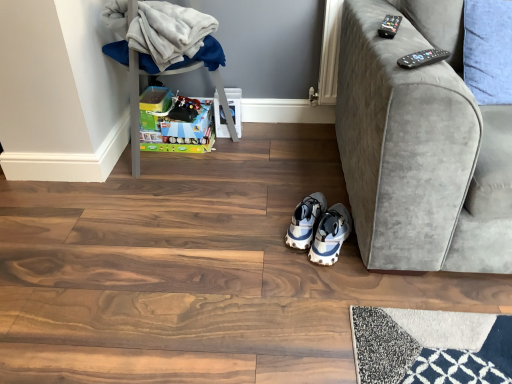
The image size is (512, 384). In order to click on white fluffy blanket at upper left in this screenshot , I will do `click(163, 36)`.

Where is `white mesh sneakers at lower center, the 2th footwear when ordered from left to right`? white mesh sneakers at lower center, the 2th footwear when ordered from left to right is located at coordinates (319, 228).

What do you see at coordinates (319, 228) in the screenshot? I see `white mesh sneakers at lower center, the 2th footwear when ordered from left to right` at bounding box center [319, 228].

This screenshot has height=384, width=512. What do you see at coordinates (176, 126) in the screenshot? I see `matte plastic toy box at lower left` at bounding box center [176, 126].

The height and width of the screenshot is (384, 512). Find the location of `velvet gray couch at upper right`. velvet gray couch at upper right is located at coordinates (412, 147).

The width and height of the screenshot is (512, 384). I want to click on white fluffy blanket at upper left, so click(163, 36).

How far apart are matte plastic toy box at lower left and black plastic remote at upper right, the 1th remote viewed from the top?

They are 1.05 meters apart.

Choose the correct answer: Is matte plastic toy box at lower left inside black plastic remote at upper right, the second remote from the front, or outside it?

matte plastic toy box at lower left is not enclosed by black plastic remote at upper right, the second remote from the front.

Is matte plastic toy box at lower left further to the viewer compared to black plastic remote at upper right, the second remote when ordered from bottom to top?

Yes, matte plastic toy box at lower left is further from the viewer.

Is matte plastic toy box at lower left taller than black plastic remote at upper right, the first remote when ordered from back to front?

Yes.

Is white fluffy blanket at upper left situated inside velvet gray couch at upper right or outside?

white fluffy blanket at upper left lies outside velvet gray couch at upper right.

Between white fluffy blanket at upper left and velvet gray couch at upper right, which one has less height?

With less height is white fluffy blanket at upper left.

From the image's perspective, which is above, white fluffy blanket at upper left or velvet gray couch at upper right?

white fluffy blanket at upper left, from the image's perspective.

Is velvet gray couch at upper right beside plastic storage box at left?

No.

Considering the positions of objects velvet gray couch at upper right and plastic storage box at left in the image provided, who is more to the left, velvet gray couch at upper right or plastic storage box at left?

Positioned to the left is plastic storage box at left.

Which is correct: velvet gray couch at upper right is inside plastic storage box at left, or outside of it?

velvet gray couch at upper right is outside plastic storage box at left.

Considering the relative sizes of velvet gray couch at upper right and plastic storage box at left in the image provided, is velvet gray couch at upper right thinner than plastic storage box at left?

In fact, velvet gray couch at upper right might be wider than plastic storage box at left.

Who is bigger, white mesh sneakers at lower center, the 2th footwear when ordered from left to right, or plastic storage box at left?

plastic storage box at left.

How far apart are white mesh sneakers at lower center, the 2th footwear when ordered from left to right, and plastic storage box at left?

The distance of white mesh sneakers at lower center, the 2th footwear when ordered from left to right, from plastic storage box at left is 32.71 inches.

Is white mesh sneakers at lower center, the 1th footwear when ordered from right to left, aimed at plastic storage box at left?

No, white mesh sneakers at lower center, the 1th footwear when ordered from right to left, is not aimed at plastic storage box at left.

Between white mesh sneakers at lower center, the 2th footwear when ordered from left to right, and plastic storage box at left, which one has less height?

white mesh sneakers at lower center, the 2th footwear when ordered from left to right, is shorter.

Measure the distance from black plastic remote at upper right, the first remote when ordered from back to front, to matte plastic toy box at lower left.

They are 3.45 feet apart.

How many degrees apart are the facing directions of black plastic remote at upper right, the first remote when ordered from back to front, and matte plastic toy box at lower left?

The facing directions of black plastic remote at upper right, the first remote when ordered from back to front, and matte plastic toy box at lower left are 68.8 degrees apart.

From the image's perspective, which is above, black plastic remote at upper right, the second remote from the front, or matte plastic toy box at lower left?

black plastic remote at upper right, the second remote from the front, is shown above in the image.

The image size is (512, 384). I want to click on toy below the black plastic remote at upper right, the 1th remote viewed from the top (from the image's perspective), so click(176, 126).

In terms of height, does velvet gray couch at upper right look taller or shorter compared to white mesh sneakers at lower center, the 2th footwear when ordered from left to right?

In the image, velvet gray couch at upper right appears to be taller than white mesh sneakers at lower center, the 2th footwear when ordered from left to right.

Is velvet gray couch at upper right completely or partially outside of white mesh sneakers at lower center, the 1th footwear when ordered from right to left?

velvet gray couch at upper right lies outside white mesh sneakers at lower center, the 1th footwear when ordered from right to left,'s area.

Between velvet gray couch at upper right and white mesh sneakers at lower center, the 2th footwear when ordered from left to right, which one has larger size?

velvet gray couch at upper right is bigger.

From the image's perspective, is velvet gray couch at upper right under white mesh sneakers at lower center, the 1th footwear when ordered from right to left?

Actually, velvet gray couch at upper right appears above white mesh sneakers at lower center, the 1th footwear when ordered from right to left, in the image.

Considering the sizes of matte plastic toy box at lower left and blue and white textured sneakers at center, the first footwear positioned from the left, in the image, is matte plastic toy box at lower left wider or thinner than blue and white textured sneakers at center, the first footwear positioned from the left,?

Clearly, matte plastic toy box at lower left has less width compared to blue and white textured sneakers at center, the first footwear positioned from the left.

How many degrees apart are the facing directions of matte plastic toy box at lower left and blue and white textured sneakers at center, the first footwear positioned from the left?

The angular difference between matte plastic toy box at lower left and blue and white textured sneakers at center, the first footwear positioned from the left, is 15.9 degrees.

Is matte plastic toy box at lower left placed right next to blue and white textured sneakers at center, the first footwear positioned from the left?

No, matte plastic toy box at lower left is not with blue and white textured sneakers at center, the first footwear positioned from the left.

In the image, there is a black plastic remote at upper right, the second remote from the front. At what (x,y) coordinates should I click in order to perform the action: click on toy below it (from a real-world perspective). Please return your answer as a coordinate pair (x, y). The width and height of the screenshot is (512, 384). Looking at the image, I should click on (176, 126).

The width and height of the screenshot is (512, 384). What are the coordinates of `blanket positioned vertically above the velvet gray couch at upper right (from a real-world perspective)` in the screenshot? It's located at (163, 36).

Considering their positions, is black plastic remote at upper right, the first remote when ordered from back to front, positioned further to matte plastic toy box at lower left than velvet gray couch at upper right?

black plastic remote at upper right, the first remote when ordered from back to front, lies further to matte plastic toy box at lower left than the other object.

Based on their spatial positions, is blue and white textured sneakers at center, the first footwear positioned from the left, or blue fabric pillow at upper right further from velvet gray couch at upper right?

blue and white textured sneakers at center, the first footwear positioned from the left, is further to velvet gray couch at upper right.

Based on their spatial positions, is plastic storage box at left or matte plastic toy box at lower left closer to black plastic remote at upper right, the 1th remote viewed from the top?

plastic storage box at left.

From the image, which object appears to be nearer to velvet gray couch at upper right, white fluffy blanket at upper left or white mesh sneakers at lower center, the 1th footwear when ordered from right to left?

Among the two, white mesh sneakers at lower center, the 1th footwear when ordered from right to left, is located nearer to velvet gray couch at upper right.

When comparing their distances from black plastic remote at upper right, the second remote from the front, does black plastic remote at upper right, which is counted as the second remote, starting from the back, or blue fabric pillow at upper right seem further?

Based on the image, blue fabric pillow at upper right appears to be further to black plastic remote at upper right, the second remote from the front.

Based on their spatial positions, is white mesh sneakers at lower center, the 2th footwear when ordered from left to right, or black plastic remote at upper right, the second remote from the front, closer to black plastic remote at upper right, placed as the 1th remote when sorted from front to back?

Based on the image, black plastic remote at upper right, the second remote from the front, appears to be nearer to black plastic remote at upper right, placed as the 1th remote when sorted from front to back.

Which object lies nearer to the anchor point white mesh sneakers at lower center, the 2th footwear when ordered from left to right, plastic storage box at left or black plastic remote at upper right, placed as the 1th remote when sorted from front to back?

black plastic remote at upper right, placed as the 1th remote when sorted from front to back.

Considering their positions, is blue and white textured sneakers at center, the first footwear positioned from the left, positioned further to black plastic remote at upper right, the second remote from the top, than matte plastic toy box at lower left?

Based on the image, matte plastic toy box at lower left appears to be further to black plastic remote at upper right, the second remote from the top.

You are a GUI agent. You are given a task and a screenshot of the screen. Output one action in this format:
    pyautogui.click(x=<x>, y=<y>)
    Task: Click on the furniture between matte plastic toy box at lower left and black plastic remote at upper right, the second remote when ordered from bottom to top
    
    Given the screenshot: What is the action you would take?
    pyautogui.click(x=156, y=45)

Locate an element on the screen. The image size is (512, 384). studio couch between plastic storage box at left and blue fabric pillow at upper right in the horizontal direction is located at coordinates (412, 147).

The image size is (512, 384). What are the coordinates of `remote located between white fluffy blanket at upper left and black plastic remote at upper right, which is the 1th remote from bottom to top, in the left-right direction` in the screenshot? It's located at (389, 26).

At what (x,y) coordinates should I click in order to perform the action: click on blanket between black plastic remote at upper right, the second remote from the top, and matte plastic toy box at lower left from front to back. Please return your answer as a coordinate pair (x, y). Looking at the image, I should click on (163, 36).